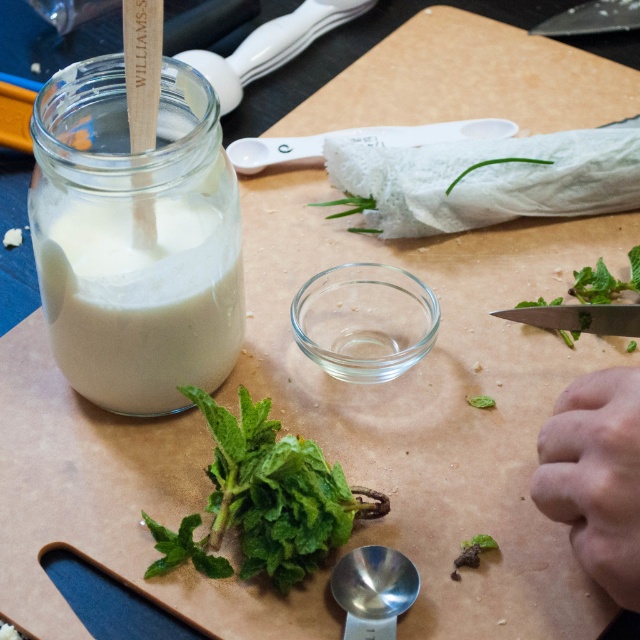
Does point (301, 448) come in front of point (573, 472)?

No, (301, 448) is further to viewer.

Between green leafy spinach at lower left and fleshy skin hand at lower right, which one is positioned lower?

green leafy spinach at lower left

Is point (280, 540) positioned after point (605, 444)?

Yes, point (280, 540) is farther from viewer.

You are a GUI agent. You are given a task and a screenshot of the screen. Output one action in this format:
    pyautogui.click(x=<x>, y=<y>)
    Task: Click on the green leafy spinach at lower left
    
    Given the screenshot: What is the action you would take?
    pyautogui.click(x=264, y=499)

You are a GUI agent. You are given a task and a screenshot of the screen. Output one action in this format:
    pyautogui.click(x=<x>, y=<y>)
    Task: Click on the white matte jar at left
    The height and width of the screenshot is (640, 640).
    Given the screenshot: What is the action you would take?
    pyautogui.click(x=141, y=301)

Can you confirm if white matte jar at left is taller than fleshy skin hand at lower right?

Correct, white matte jar at left is much taller as fleshy skin hand at lower right.

Image resolution: width=640 pixels, height=640 pixels. In order to click on white matte jar at left in this screenshot , I will do `click(141, 301)`.

Which is behind, point (44, 243) or point (301, 516)?

Point (44, 243)

Who is higher up, white matte jar at left or green leafy spinach at lower left?

white matte jar at left is above.

Where is `white matte jar at left`? Image resolution: width=640 pixels, height=640 pixels. white matte jar at left is located at coordinates (141, 301).